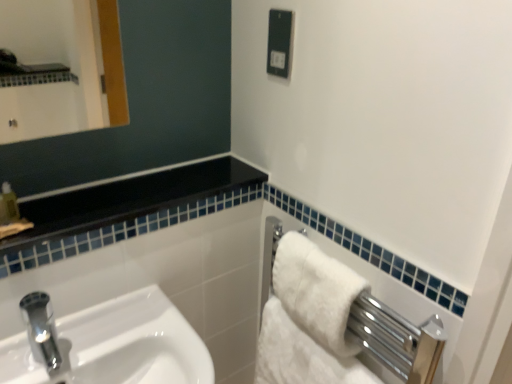
Question: Is black plastic electric outlet at upper center taller than white glossy sink at lower left?

Choices:
 (A) no
 (B) yes

Answer: (A)

Question: From a real-world perspective, does black plastic electric outlet at upper center stand above white glossy sink at lower left?

Choices:
 (A) no
 (B) yes

Answer: (B)

Question: Is the surface of black plastic electric outlet at upper center in direct contact with white glossy sink at lower left?

Choices:
 (A) yes
 (B) no

Answer: (B)

Question: Is black plastic electric outlet at upper center at the left side of white glossy sink at lower left?

Choices:
 (A) yes
 (B) no

Answer: (B)

Question: Is black plastic electric outlet at upper center to the right of white glossy sink at lower left from the viewer's perspective?

Choices:
 (A) no
 (B) yes

Answer: (B)

Question: From a real-world perspective, relative to black plastic electric outlet at upper center, is white glossy sink at lower left vertically above or below?

Choices:
 (A) below
 (B) above

Answer: (A)

Question: Based on their positions, is white glossy sink at lower left located to the left or right of black plastic electric outlet at upper center?

Choices:
 (A) right
 (B) left

Answer: (B)

Question: Looking at the image, does white glossy sink at lower left seem bigger or smaller compared to black plastic electric outlet at upper center?

Choices:
 (A) small
 (B) big

Answer: (B)

Question: Considering the positions of white glossy sink at lower left and black plastic electric outlet at upper center in the image, is white glossy sink at lower left taller or shorter than black plastic electric outlet at upper center?

Choices:
 (A) tall
 (B) short

Answer: (A)

Question: Based on their positions, is black glossy balustrade at upper left located to the left or right of white glossy sink at lower left?

Choices:
 (A) right
 (B) left

Answer: (A)

Question: Would you say black glossy balustrade at upper left is inside or outside white glossy sink at lower left?

Choices:
 (A) outside
 (B) inside

Answer: (A)

Question: Is point (104, 200) closer or farther from the camera than point (22, 337)?

Choices:
 (A) farther
 (B) closer

Answer: (A)

Question: From the image's perspective, is black glossy balustrade at upper left located above or below white glossy sink at lower left?

Choices:
 (A) below
 (B) above

Answer: (B)

Question: Is black glossy balustrade at upper left in front of or behind white fluffy bath towel at right, positioned as the 1th bath towel in bottom-to-top order, in the image?

Choices:
 (A) front
 (B) behind

Answer: (A)

Question: Is point (89, 210) positioned closer to the camera than point (321, 365)?

Choices:
 (A) closer
 (B) farther

Answer: (B)